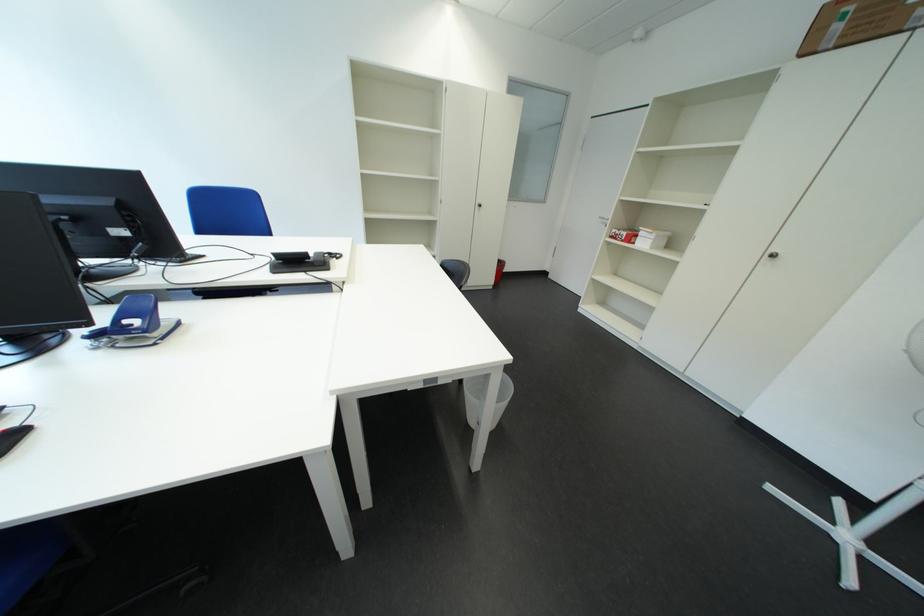
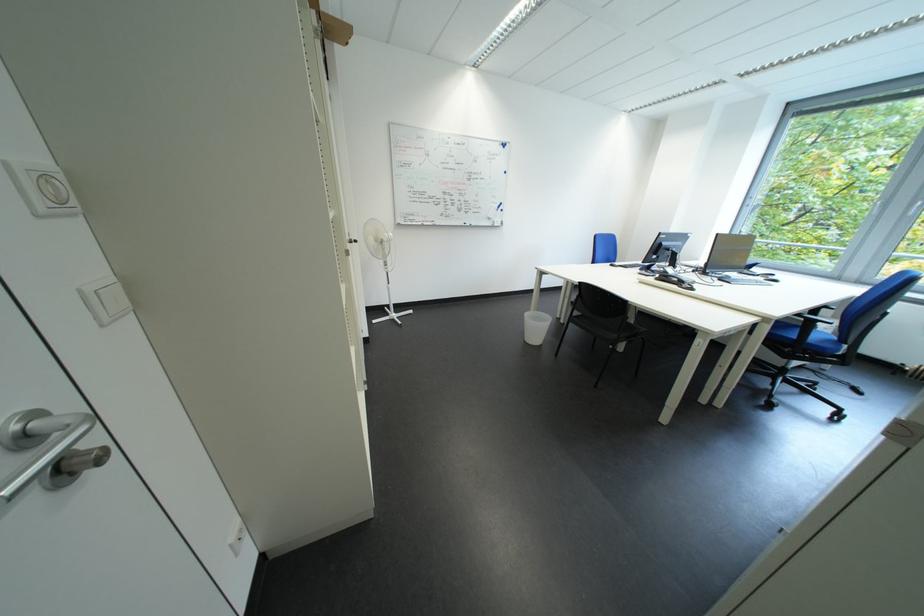
The point at [341,272] is marked in the first image. Where is the corresponding point in the second image?

(669, 282)